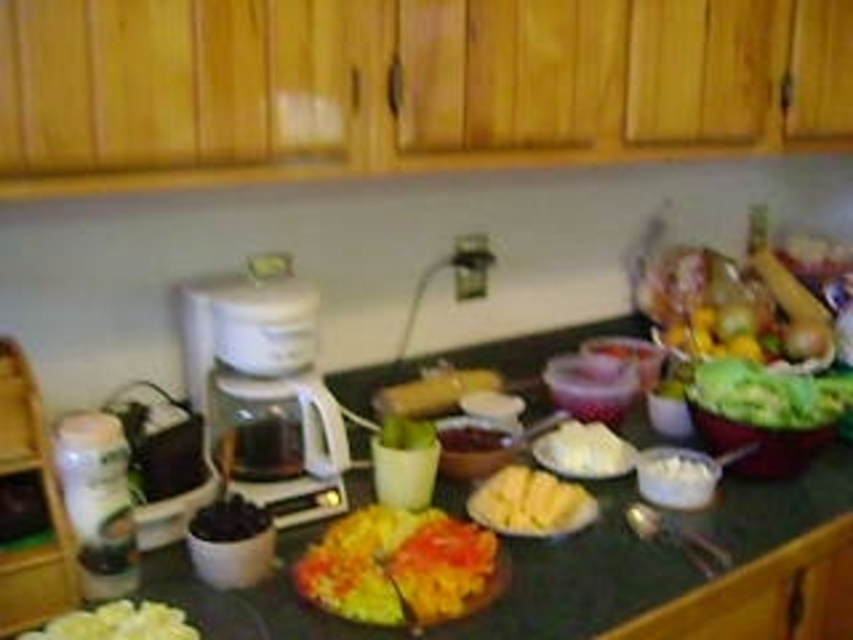
Question: Which point appears farthest from the camera in this image?

Choices:
 (A) (431, 582)
 (B) (804, 403)
 (C) (585, 422)
 (D) (235, 525)

Answer: (C)

Question: Which object appears farthest from the camera in this image?

Choices:
 (A) green leafy lettuce at center right
 (B) white creamy bowl at center
 (C) white creamy cheese at center
 (D) matte brown bowl at center

Answer: (D)

Question: Can you confirm if green matte counter top at center is wider than shiny yellow corn at center?

Choices:
 (A) no
 (B) yes

Answer: (B)

Question: Which point is farther from the camera taking this photo?

Choices:
 (A) (550, 442)
 (B) (654, 468)
 (C) (474, 426)

Answer: (C)

Question: Is the position of white creamy bowl at center less distant than that of dark matte blueberries at center?

Choices:
 (A) no
 (B) yes

Answer: (A)

Question: Does white creamy cheese at center have a larger size compared to white creamy bowl at center?

Choices:
 (A) yes
 (B) no

Answer: (A)